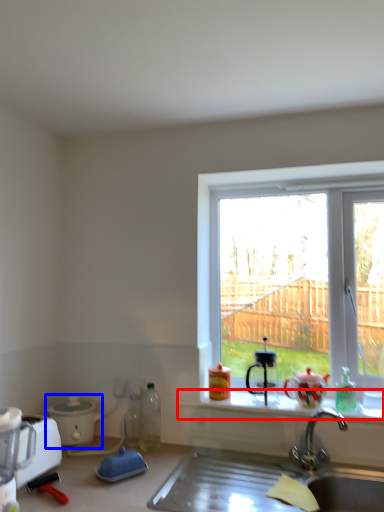
Question: Which of the following is the closest to the observer, window sill (highlighted by a red box) or appliance (highlighted by a blue box)?

Choices:
 (A) window sill
 (B) appliance

Answer: (A)